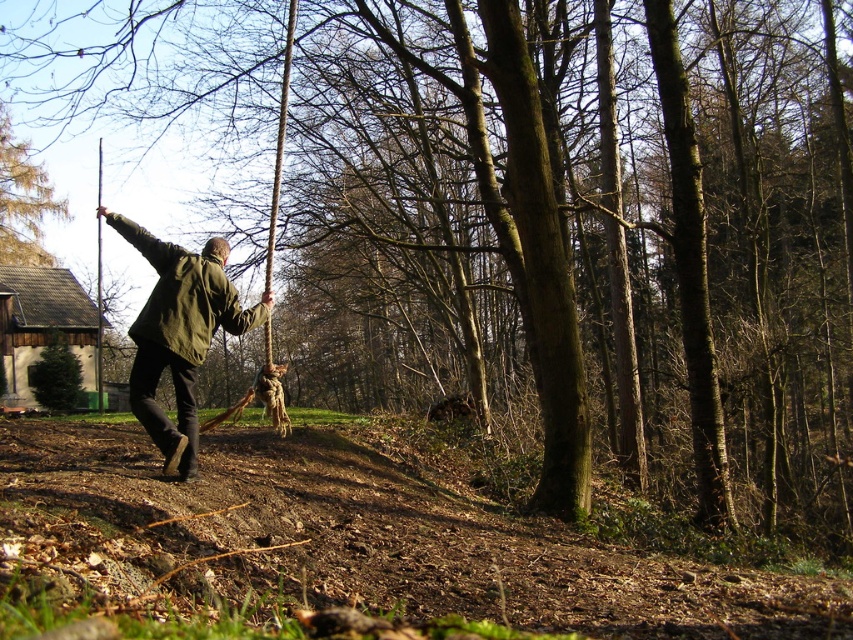
Question: Which point is farther to the camera?

Choices:
 (A) brown rough tree at upper left
 (B) green matte jacket at center

Answer: (A)

Question: In this image, where is green matte jacket at center located relative to brown rough tree at upper left?

Choices:
 (A) below
 (B) above

Answer: (A)

Question: Which point is closer to the camera?

Choices:
 (A) green matte jacket at center
 (B) brown rough tree at upper left

Answer: (A)

Question: Is green matte jacket at center positioned behind brown rough tree at upper left?

Choices:
 (A) no
 (B) yes

Answer: (A)

Question: Can you confirm if green matte jacket at center is bigger than brown rough tree at upper left?

Choices:
 (A) yes
 (B) no

Answer: (A)